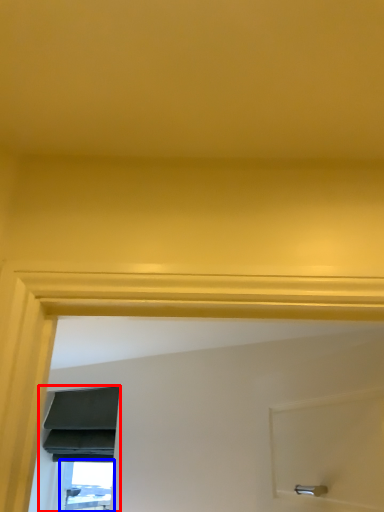
Question: Which object is closer to the camera taking this photo, window (highlighted by a red box) or window (highlighted by a blue box)?

Choices:
 (A) window
 (B) window

Answer: (A)